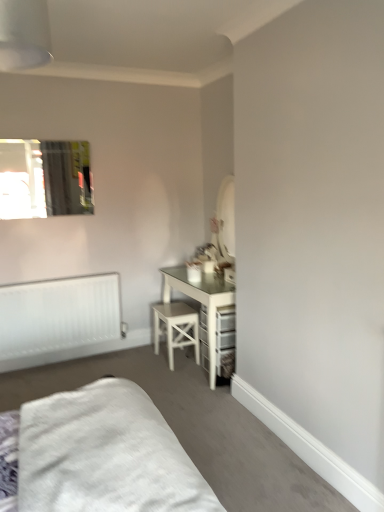
Describe the element at coordinates (57, 319) in the screenshot. The width and height of the screenshot is (384, 512). I see `white matte radiator at lower left` at that location.

Where is `white soft bed at lower left`? white soft bed at lower left is located at coordinates pyautogui.click(x=104, y=455).

Locate an element on the screen. The image size is (384, 512). white wood stool at center is located at coordinates (176, 328).

You are a GUI agent. You are given a task and a screenshot of the screen. Output one action in this format:
    pyautogui.click(x=<x>, y=<y>)
    Task: Click on the white matte radiator at lower left
    
    Given the screenshot: What is the action you would take?
    pyautogui.click(x=57, y=319)

Based on their positions, is white matte radiator at lower left located to the left or right of white soft bed at lower left?

Clearly, white matte radiator at lower left is on the left of white soft bed at lower left in the image.

The width and height of the screenshot is (384, 512). What are the coordinates of `bed lying below the white matte radiator at lower left (from the image's perspective)` in the screenshot? It's located at (104, 455).

How far apart are white matte radiator at lower left and white soft bed at lower left?

The distance of white matte radiator at lower left from white soft bed at lower left is 6.03 feet.

Considering the relative sizes of white matte radiator at lower left and white soft bed at lower left in the image provided, is white matte radiator at lower left taller than white soft bed at lower left?

Yes.

Is white wood stool at center oriented away from white soft bed at lower left?

No, white wood stool at center is not facing the opposite direction of white soft bed at lower left.

You are a GUI agent. You are given a task and a screenshot of the screen. Output one action in this format:
    pyautogui.click(x=<x>, y=<y>)
    Task: Click on the bed located below the white wood stool at center (from the image's perspective)
    The height and width of the screenshot is (512, 384).
    Given the screenshot: What is the action you would take?
    pyautogui.click(x=104, y=455)

From the image's perspective, does white wood stool at center appear lower than white soft bed at lower left?

No.

Is white matte radiator at lower left wider or thinner than clear glass mirror at upper left?

Clearly, white matte radiator at lower left has more width compared to clear glass mirror at upper left.

Which is farther, (42, 361) or (50, 149)?

The point (42, 361) is farther.

Is white matte radiator at lower left positioned behind clear glass mirror at upper left?

That is True.

Would you consider white matte radiator at lower left to be distant from clear glass mirror at upper left?

No.

Considering the relative sizes of white soft bed at lower left and clear glass mirror at upper left in the image provided, is white soft bed at lower left taller than clear glass mirror at upper left?

No, white soft bed at lower left is not taller than clear glass mirror at upper left.

Between point (134, 391) and point (80, 176), which one is positioned in front?

The point (134, 391) is closer to the camera.

Based on the photo, which object is further away from the camera taking this photo, white soft bed at lower left or clear glass mirror at upper left?

Positioned behind is clear glass mirror at upper left.

Considering the relative sizes of white soft bed at lower left and clear glass mirror at upper left in the image provided, is white soft bed at lower left wider than clear glass mirror at upper left?

Yes.

Between white soft bed at lower left and white matte radiator at lower left, which one appears on the right side from the viewer's perspective?

white soft bed at lower left.

Considering the sizes of objects white soft bed at lower left and white matte radiator at lower left in the image provided, who is smaller, white soft bed at lower left or white matte radiator at lower left?

white soft bed at lower left is smaller.

Is point (132, 452) positioned behind point (20, 335)?

That is False.

Can we say white soft bed at lower left lies outside white matte radiator at lower left?

Yes, white soft bed at lower left is outside of white matte radiator at lower left.

Do you think white soft bed at lower left is within white wood stool at center, or outside of it?

white soft bed at lower left is spatially situated outside white wood stool at center.

The height and width of the screenshot is (512, 384). I want to click on bed in front of the white wood stool at center, so click(x=104, y=455).

Does white soft bed at lower left have a lesser height compared to white wood stool at center?

Correct, white soft bed at lower left is not as tall as white wood stool at center.

Is point (111, 410) positioned behind point (168, 344)?

No, (111, 410) is in front of (168, 344).

Considering the positions of points (185, 329) and (44, 332), is point (185, 329) closer to camera compared to point (44, 332)?

Yes, point (185, 329) is closer to viewer.

Does white wood stool at center have a lesser width compared to white matte radiator at lower left?

Incorrect, the width of white wood stool at center is not less than that of white matte radiator at lower left.

Considering the sizes of objects white wood stool at center and white matte radiator at lower left in the image provided, who is bigger, white wood stool at center or white matte radiator at lower left?

white matte radiator at lower left is bigger.

Considering the sizes of objects white wood stool at center and white matte radiator at lower left in the image provided, who is shorter, white wood stool at center or white matte radiator at lower left?

With less height is white wood stool at center.

Where is `bed on the right of white matte radiator at lower left`? bed on the right of white matte radiator at lower left is located at coordinates (104, 455).

Identify the location of bed in front of the white wood stool at center. (104, 455).

Which object lies nearer to the anchor point clear glass mirror at upper left, white soft bed at lower left or white matte radiator at lower left?

white matte radiator at lower left is positioned closer to the anchor clear glass mirror at upper left.

Looking at the image, which one is located closer to white wood stool at center, clear glass mirror at upper left or white matte radiator at lower left?

Among the two, white matte radiator at lower left is located nearer to white wood stool at center.

When comparing their distances from white soft bed at lower left, does white matte radiator at lower left or clear glass mirror at upper left seem further?

clear glass mirror at upper left is positioned further to the anchor white soft bed at lower left.

Looking at this image, from the image, which object appears to be nearer to white soft bed at lower left, clear glass mirror at upper left or white matte radiator at lower left?

white matte radiator at lower left lies closer to white soft bed at lower left than the other object.

Based on their spatial positions, is white wood stool at center or white soft bed at lower left closer to white matte radiator at lower left?

white wood stool at center lies closer to white matte radiator at lower left than the other object.

From the image, which object appears to be nearer to white soft bed at lower left, white wood stool at center or clear glass mirror at upper left?

white wood stool at center lies closer to white soft bed at lower left than the other object.

From the image, which object appears to be farther from white soft bed at lower left, white matte radiator at lower left or white wood stool at center?

The object further to white soft bed at lower left is white matte radiator at lower left.

Which object lies nearer to the anchor point white wood stool at center, white soft bed at lower left or clear glass mirror at upper left?

Based on the image, clear glass mirror at upper left appears to be nearer to white wood stool at center.

What are the coordinates of `radiator between white soft bed at lower left and white wood stool at center from front to back` in the screenshot? It's located at (57, 319).

At what (x,y) coordinates should I click in order to perform the action: click on window located between white soft bed at lower left and white matte radiator at lower left in the depth direction. Please return your answer as a coordinate pair (x, y). Looking at the image, I should click on (44, 178).

This screenshot has height=512, width=384. Identify the location of radiator that lies between clear glass mirror at upper left and white wood stool at center from top to bottom. click(x=57, y=319).

Identify the location of window positioned between white soft bed at lower left and white wood stool at center from near to far. (44, 178).